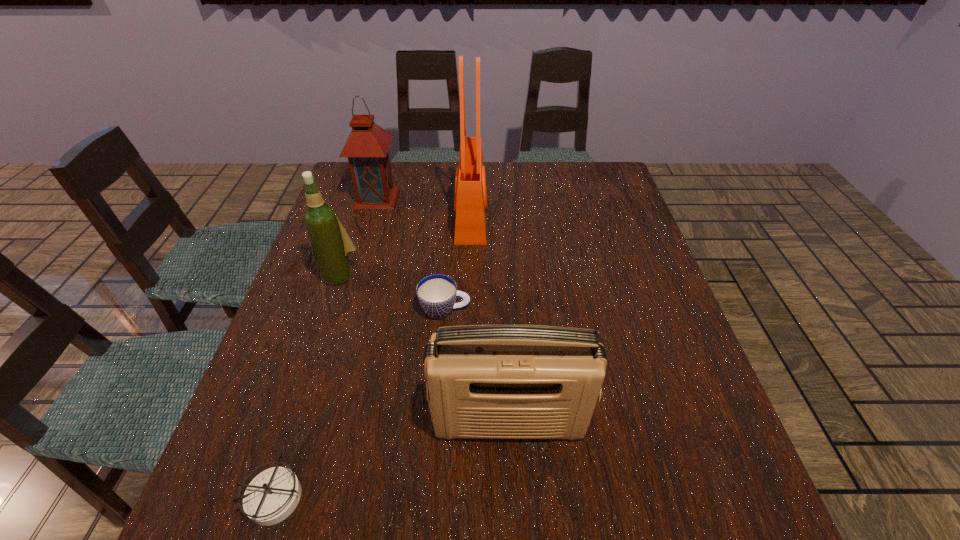
Identify the location of object that is positioned at the near left corner. The width and height of the screenshot is (960, 540). (272, 495).

Where is `vacant area at the far edge`? The width and height of the screenshot is (960, 540). vacant area at the far edge is located at coordinates click(488, 193).

Find the location of a particular element. Image resolution: width=960 pixels, height=540 pixels. free spot at the left edge of the desktop is located at coordinates (328, 292).

Find the location of `vacant space at the right edge of the desktop`. vacant space at the right edge of the desktop is located at coordinates (599, 215).

Find the location of a particular element. This screenshot has height=540, width=960. free region at the far right corner is located at coordinates (587, 161).

This screenshot has width=960, height=540. I want to click on blank space at the near right corner of the desktop, so click(695, 508).

Where is `free space between the cup and the tote bag`? This screenshot has width=960, height=540. free space between the cup and the tote bag is located at coordinates (458, 263).

I want to click on unoccupied position between the radio receiver and the wine bottle, so click(424, 348).

Where is `unoccupied area between the fourth nearest object and the fourth farthest object`? The image size is (960, 540). unoccupied area between the fourth nearest object and the fourth farthest object is located at coordinates (392, 292).

Where is `vacant area between the second nearest object and the wine bottle`? vacant area between the second nearest object and the wine bottle is located at coordinates (424, 348).